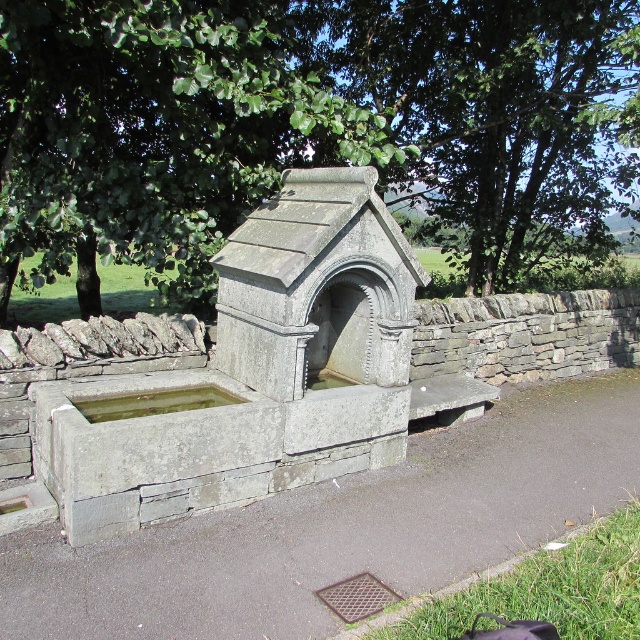
Question: In this image, where is gray stone trough at center located relative to green leafy tree at upper center?

Choices:
 (A) right
 (B) left

Answer: (B)

Question: Is green leafy tree at upper left above green leafy tree at upper center?

Choices:
 (A) yes
 (B) no

Answer: (B)

Question: Which object is closer to the camera taking this photo?

Choices:
 (A) green stone trough at center
 (B) green leafy tree at upper left

Answer: (A)

Question: Is gray stone trough at center smaller than green leafy tree at upper center?

Choices:
 (A) no
 (B) yes

Answer: (B)

Question: Which point is farther to the camera?

Choices:
 (A) green leafy tree at upper left
 (B) gray stone trough at center

Answer: (A)

Question: Considering the real-world distances, which object is farthest from the green leafy tree at upper left?

Choices:
 (A) gray stone trough at center
 (B) green leafy tree at upper center
 (C) green stone trough at center

Answer: (B)